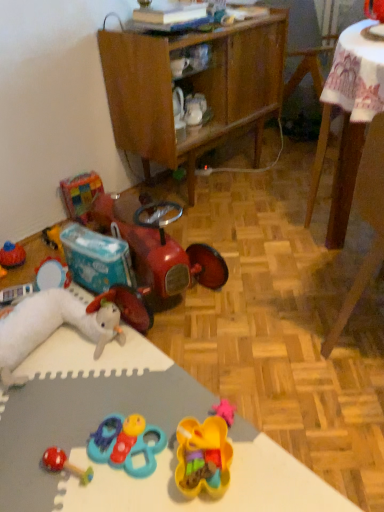
The image size is (384, 512). Identify the location of vacant space to the right of teal plastic toy at center, positioned as the 3th toy in right-to-left order. (198, 420).